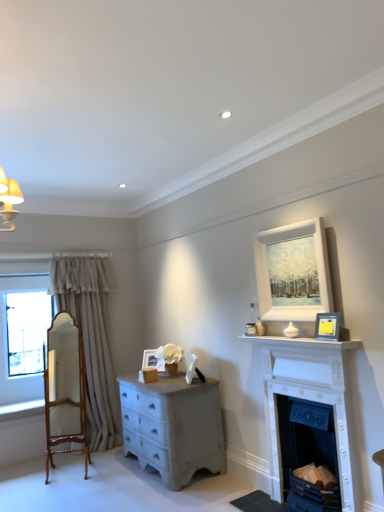
What do you see at coordinates (152, 360) in the screenshot? I see `matte white picture frame at center, which is the first picture frame from back to front` at bounding box center [152, 360].

This screenshot has height=512, width=384. What do you see at coordinates (307, 453) in the screenshot?
I see `white painted wood fireplace at lower right, which ranks as the second fireplace in top-to-bottom order` at bounding box center [307, 453].

This screenshot has width=384, height=512. I want to click on matte white picture frame at upper right, positioned as the third picture frame in left-to-right order, so click(312, 271).

Describe the element at coordinates (191, 369) in the screenshot. I see `white matte picture frame at center, which appears as the third picture frame when viewed from the right` at that location.

How much space does white painted wood fireplace at right, which is the 2th fireplace in bottom-to-top order, occupy vertically?

It is 1.24 meters.

What is the approximate width of white painted wood mantle at upper center?

white painted wood mantle at upper center is 8.16 inches wide.

Where is `matte white picture frame at center, arranged as the 4th picture frame when viewed from the right`? Image resolution: width=384 pixels, height=512 pixels. matte white picture frame at center, arranged as the 4th picture frame when viewed from the right is located at coordinates (152, 360).

Is matte white picture frame at upper right, arranged as the third picture frame when viewed from the back, touching white painted wood mantle at upper center?

They are not placed beside each other.

In the image, is matte white picture frame at upper right, which is counted as the second picture frame, starting from the right, positioned in front of or behind white painted wood mantle at upper center?

Clearly, matte white picture frame at upper right, which is counted as the second picture frame, starting from the right, is behind white painted wood mantle at upper center.

Is point (277, 311) closer or farther from the camera than point (283, 341)?

Point (277, 311).

Where is `curtain on the left of matte white picture frame at upper right, which ranks as the fourth picture frame in bottom-to-top order`? curtain on the left of matte white picture frame at upper right, which ranks as the fourth picture frame in bottom-to-top order is located at coordinates (91, 339).

From the image's perspective, is matte white picture frame at upper right, which is counted as the second picture frame, starting from the right, located beneath beige fabric curtain at left?

Incorrect, from the image's perspective, matte white picture frame at upper right, which is counted as the second picture frame, starting from the right, is higher than beige fabric curtain at left.

From the picture: Is matte white picture frame at upper right, arranged as the third picture frame when viewed from the back, oriented towards beige fabric curtain at left?

No, matte white picture frame at upper right, arranged as the third picture frame when viewed from the back, is not aimed at beige fabric curtain at left.

How many degrees apart are the facing directions of wooden polished mirror at left and beige fabric curtain at left?

64.4 degrees separate the facing orientations of wooden polished mirror at left and beige fabric curtain at left.

Is wooden polished mirror at left oriented away from beige fabric curtain at left?

Yes, beige fabric curtain at left is at the back of wooden polished mirror at left.

Considering the positions of points (75, 362) and (73, 304), is point (75, 362) farther from camera compared to point (73, 304)?

No, (75, 362) is in front of (73, 304).

Considering the positions of objects wooden polished mirror at left and beige fabric curtain at left in the image provided, who is more to the right, wooden polished mirror at left or beige fabric curtain at left?

From the viewer's perspective, beige fabric curtain at left appears more on the right side.

From a real-world perspective, is black matte picture frame at upper right, positioned as the 2th picture frame in top-to-bottom order, above or below matte white picture frame at upper right, which is counted as the second picture frame, starting from the right?

Clearly, from a real-world perspective, black matte picture frame at upper right, positioned as the 2th picture frame in top-to-bottom order, is below matte white picture frame at upper right, which is counted as the second picture frame, starting from the right.

Based on the photo, could you tell me if black matte picture frame at upper right, which is counted as the third picture frame, starting from the bottom, is facing matte white picture frame at upper right, positioned as the second picture frame in front-to-back order?

No.

From the image's perspective, is black matte picture frame at upper right, the 4th picture frame in the back-to-front sequence, positioned above or below matte white picture frame at upper right, which is counted as the second picture frame, starting from the right?

Clearly, from the image's perspective, black matte picture frame at upper right, the 4th picture frame in the back-to-front sequence, is below matte white picture frame at upper right, which is counted as the second picture frame, starting from the right.

In the scene shown: Would you say black matte picture frame at upper right, which is counted as the third picture frame, starting from the bottom, is outside matte white picture frame at upper right, which ranks as the 1th picture frame in top-to-bottom order?

Yes.

Are white painted wood mantle at upper center and white painted wood fireplace at lower right, which ranks as the second fireplace in top-to-bottom order, beside each other?

No, white painted wood mantle at upper center is not with white painted wood fireplace at lower right, which ranks as the second fireplace in top-to-bottom order.

From a real-world perspective, between white painted wood mantle at upper center and white painted wood fireplace at lower right, which ranks as the second fireplace in top-to-bottom order, who is vertically lower?

In real-world perspective, white painted wood fireplace at lower right, which ranks as the second fireplace in top-to-bottom order, is lower.

In the image, is white painted wood mantle at upper center positioned in front of or behind white painted wood fireplace at lower right, which ranks as the second fireplace in top-to-bottom order?

In the image, white painted wood mantle at upper center appears in front of white painted wood fireplace at lower right, which ranks as the second fireplace in top-to-bottom order.

Does white painted wood mantle at upper center have a lesser height compared to white painted wood fireplace at lower right, which ranks as the second fireplace in top-to-bottom order?

Yes, white painted wood mantle at upper center is shorter than white painted wood fireplace at lower right, which ranks as the second fireplace in top-to-bottom order.

Does point (328, 488) lie in front of point (188, 365)?

Yes, it is in front of point (188, 365).

From the white painted wood fireplace at lower right, the first fireplace ordered from the bottom, count the 3rd picture frame to the left and point to it. Please provide its 2D coordinates.

[(191, 369)]

Is white painted wood fireplace at lower right, the first fireplace ordered from the bottom, beside white matte picture frame at center, which is the third picture frame in top-to-bottom order?

There is a gap between white painted wood fireplace at lower right, the first fireplace ordered from the bottom, and white matte picture frame at center, which is the third picture frame in top-to-bottom order.

Does white painted wood fireplace at lower right, which ranks as the second fireplace in top-to-bottom order, turn towards white matte picture frame at center, acting as the 2th picture frame starting from the back?

No, white painted wood fireplace at lower right, which ranks as the second fireplace in top-to-bottom order, is not facing towards white matte picture frame at center, acting as the 2th picture frame starting from the back.

Does beige fabric curtain at left have a greater width compared to matte white picture frame at center, which is the first picture frame from back to front?

Correct, the width of beige fabric curtain at left exceeds that of matte white picture frame at center, which is the first picture frame from back to front.

From a real-world perspective, is beige fabric curtain at left over matte white picture frame at center, marked as the 1th picture frame in a left-to-right arrangement?

Indeed, from a real-world perspective, beige fabric curtain at left stands above matte white picture frame at center, marked as the 1th picture frame in a left-to-right arrangement.

From the image's perspective, does beige fabric curtain at left appear higher than matte white picture frame at center, which appears as the 4th picture frame when viewed from the top?

Indeed, from the image's perspective, beige fabric curtain at left is shown above matte white picture frame at center, which appears as the 4th picture frame when viewed from the top.

Could you tell me if beige fabric curtain at left is turned towards matte white picture frame at center, which appears as the 4th picture frame when viewed from the top?

No, beige fabric curtain at left is not facing towards matte white picture frame at center, which appears as the 4th picture frame when viewed from the top.

Identify the location of mantle lying in front of the matte white picture frame at upper right, which ranks as the fourth picture frame in bottom-to-top order. (300, 342).

Where is `curtain beneath the matte white picture frame at upper right, which ranks as the 1th picture frame in top-to-bottom order (from a real-world perspective)`? Image resolution: width=384 pixels, height=512 pixels. curtain beneath the matte white picture frame at upper right, which ranks as the 1th picture frame in top-to-bottom order (from a real-world perspective) is located at coordinates (91, 339).

From the image, which object appears to be nearer to black matte picture frame at upper right, positioned as the 2th picture frame in top-to-bottom order, beige fabric curtain at left or matte white picture frame at upper right, positioned as the second picture frame in front-to-back order?

Among the two, matte white picture frame at upper right, positioned as the second picture frame in front-to-back order, is located nearer to black matte picture frame at upper right, positioned as the 2th picture frame in top-to-bottom order.

Estimate the real-world distances between objects in this image. Which object is further from beige fabric curtain at left, wooden polished mirror at left or white matte picture frame at center, acting as the 2th picture frame starting from the back?

white matte picture frame at center, acting as the 2th picture frame starting from the back, is positioned further to the anchor beige fabric curtain at left.

Looking at the image, which one is located closer to white painted wood fireplace at right, which is the 2th fireplace in bottom-to-top order, black matte picture frame at upper right, positioned as the 2th picture frame in top-to-bottom order, or matte white picture frame at upper right, which is counted as the second picture frame, starting from the right?

Based on the image, black matte picture frame at upper right, positioned as the 2th picture frame in top-to-bottom order, appears to be nearer to white painted wood fireplace at right, which is the 2th fireplace in bottom-to-top order.

Based on their spatial positions, is black matte picture frame at upper right, the 4th picture frame in the back-to-front sequence, or beige fabric curtain at left closer to white painted wood fireplace at lower right, the first fireplace ordered from the bottom?

black matte picture frame at upper right, the 4th picture frame in the back-to-front sequence, is positioned closer to the anchor white painted wood fireplace at lower right, the first fireplace ordered from the bottom.

When comparing their distances from matte white picture frame at upper right, arranged as the third picture frame when viewed from the back, does white matte picture frame at center, marked as the 3th picture frame in a front-to-back arrangement, or beige fabric curtain at left seem further?

beige fabric curtain at left lies further to matte white picture frame at upper right, arranged as the third picture frame when viewed from the back, than the other object.

Looking at the image, which one is located closer to beige fabric curtain at left, white painted wood mantle at upper center or white painted wood fireplace at right, which is the 2th fireplace in bottom-to-top order?

white painted wood mantle at upper center.

Which object lies nearer to the anchor point wooden polished mirror at left, white matte picture frame at center, marked as the 3th picture frame in a front-to-back arrangement, or white painted wood fireplace at lower right, which ranks as the second fireplace in top-to-bottom order?

The object closer to wooden polished mirror at left is white matte picture frame at center, marked as the 3th picture frame in a front-to-back arrangement.

When comparing their distances from white painted wood fireplace at lower right, which ranks as the second fireplace in top-to-bottom order, does matte white picture frame at center, marked as the 1th picture frame in a left-to-right arrangement, or black matte picture frame at upper right, the 1th picture frame from the right, seem closer?

black matte picture frame at upper right, the 1th picture frame from the right, is closer to white painted wood fireplace at lower right, which ranks as the second fireplace in top-to-bottom order.

The height and width of the screenshot is (512, 384). Identify the location of fireplace between white painted wood fireplace at right, which is the 1th fireplace from top to bottom, and matte white picture frame at center, the first picture frame when ordered from bottom to top, in the front-back direction. (307, 453).

Where is `mantle that lies between black matte picture frame at upper right, which is counted as the third picture frame, starting from the bottom, and white painted wood fireplace at right, which is the 2th fireplace in bottom-to-top order, from top to bottom`? The image size is (384, 512). mantle that lies between black matte picture frame at upper right, which is counted as the third picture frame, starting from the bottom, and white painted wood fireplace at right, which is the 2th fireplace in bottom-to-top order, from top to bottom is located at coordinates click(300, 342).

Locate an element on the screen. curtain located between wooden polished mirror at left and matte white picture frame at upper right, which ranks as the fourth picture frame in bottom-to-top order, in the left-right direction is located at coordinates (91, 339).

Image resolution: width=384 pixels, height=512 pixels. What are the coordinates of `mantle between black matte picture frame at upper right, placed as the fourth picture frame when sorted from left to right, and white painted wood fireplace at lower right, the first fireplace ordered from the bottom, in the up-down direction` in the screenshot? It's located at (300, 342).